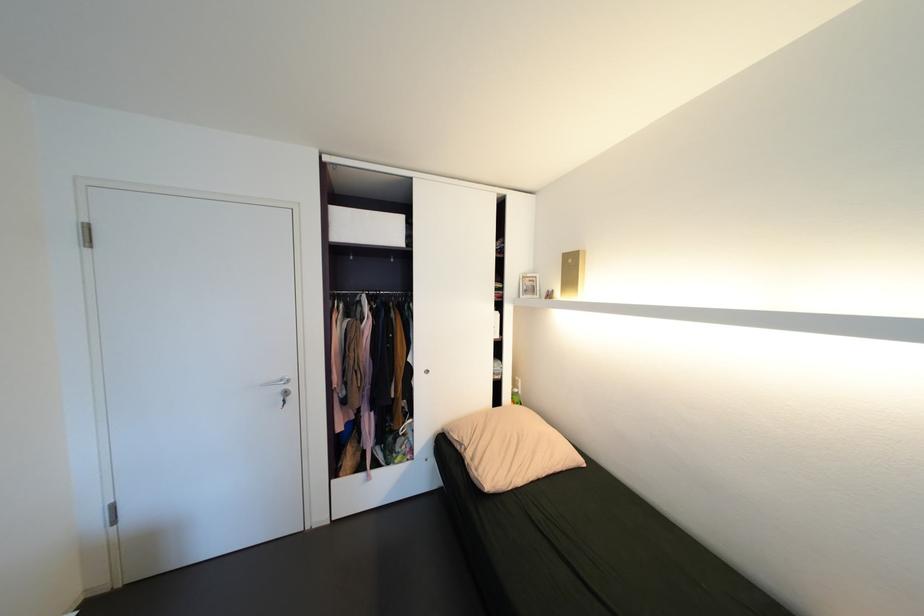
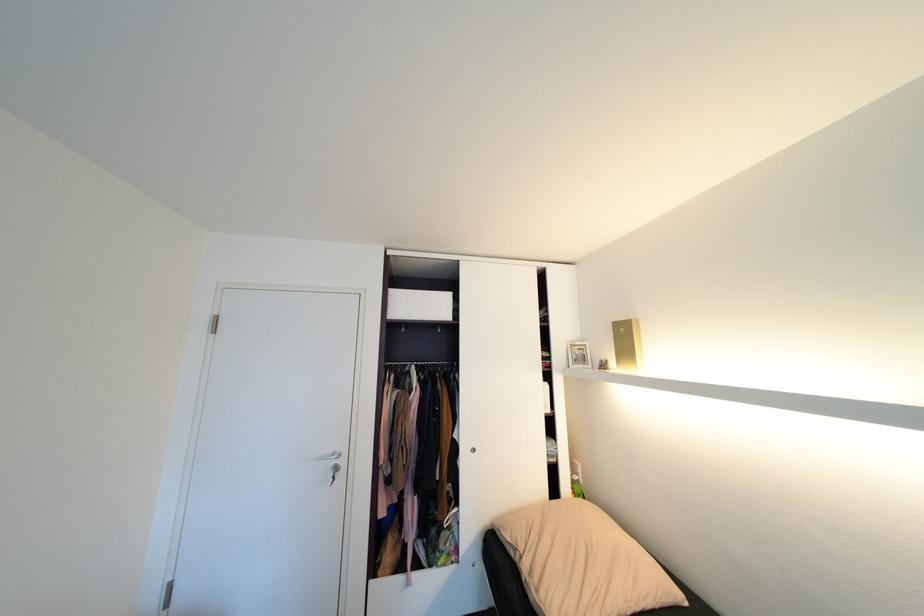
Locate, in the second image, the point that corresponds to (x=537, y=282) in the first image.

(587, 350)